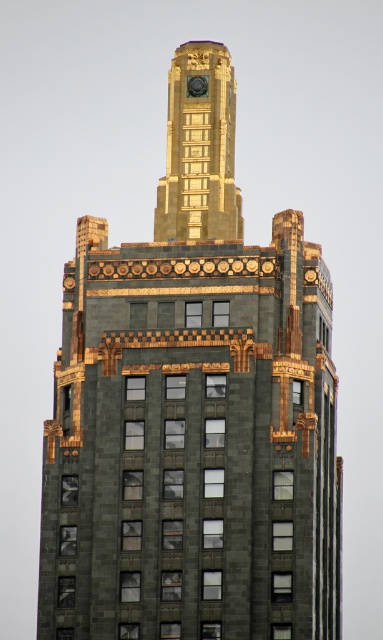
Question: Can you confirm if gold/golden metal clock tower at upper center is smaller than polished brass clock at upper center?

Choices:
 (A) yes
 (B) no

Answer: (B)

Question: Among these points, which one is farthest from the camera?

Choices:
 (A) (163, 186)
 (B) (207, 90)

Answer: (B)

Question: Is gold/golden metal clock tower at upper center above polished brass clock at upper center?

Choices:
 (A) no
 (B) yes

Answer: (B)

Question: Which of the following is the farthest from the observer?

Choices:
 (A) (234, 230)
 (B) (202, 76)

Answer: (B)

Question: Is gold/golden metal clock tower at upper center above polished brass clock at upper center?

Choices:
 (A) no
 (B) yes

Answer: (B)

Question: Among these objects, which one is nearest to the camera?

Choices:
 (A) gold/golden metal clock tower at upper center
 (B) polished brass clock at upper center

Answer: (A)